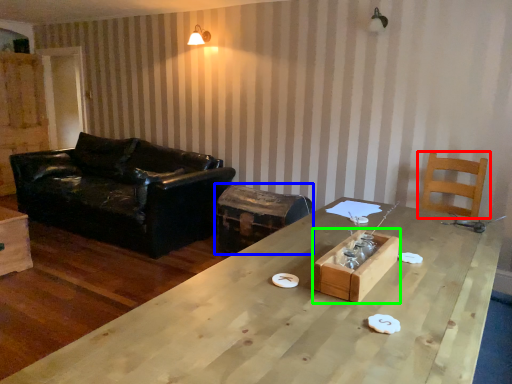
Question: Which object is positioned closest to chair (highlighted by a red box)? Select from swivel chair (highlighted by a blue box) and crate (highlighted by a green box).

Choices:
 (A) swivel chair
 (B) crate

Answer: (A)